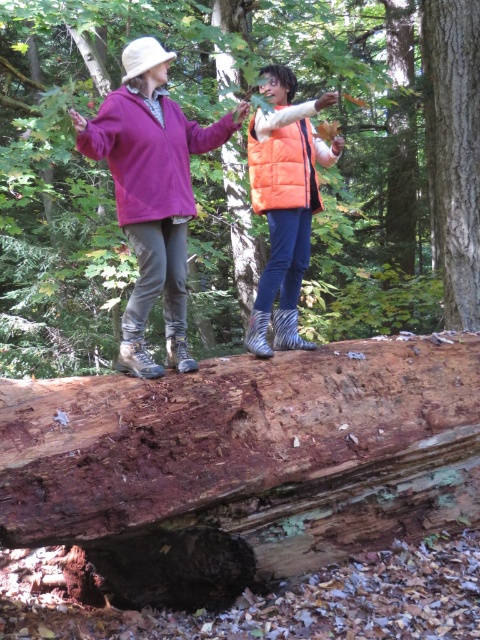
You are standing at the point marked by the coordinates (243, 465) in the forest scene. What object are you standing on?

The point marked by the coordinates (243, 465) is on the brown rough wood log at center.

Consider the image. You are a hiker who just entered the forest and see the two people in the image. You want to approach the person wearing the matte purple fleece jacket at center. Which direction should you move relative to the matte purple fleece at upper left?

The matte purple fleece at upper left is to the left of the matte purple fleece jacket at center. Therefore, to reach the matte purple fleece jacket at center, you should move to the right from the matte purple fleece at upper left.